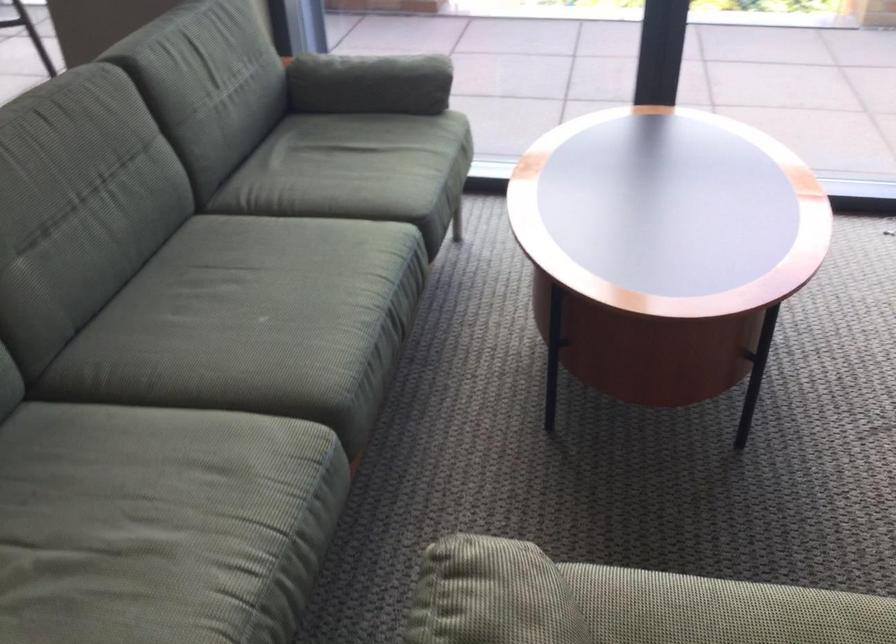
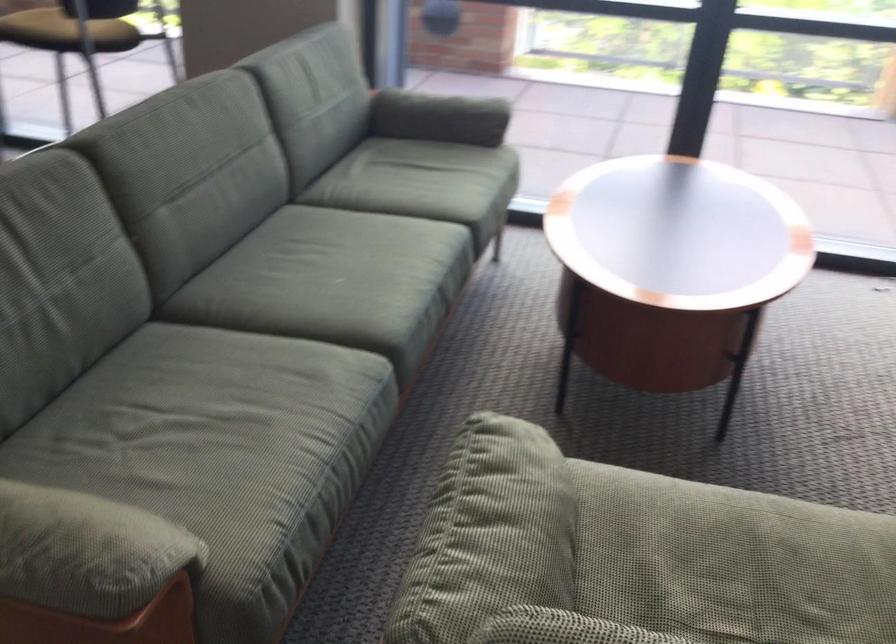
In the second image, find the point that corresponds to the point at 113,574 in the first image.

(225, 430)